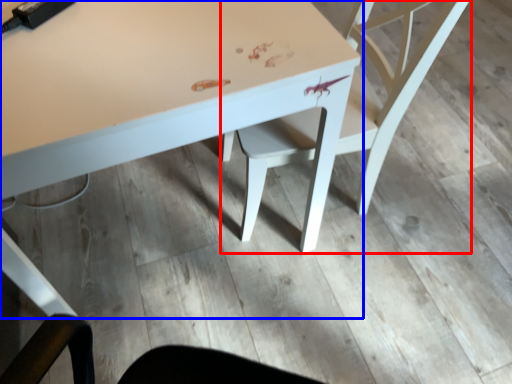
Question: Which object appears farthest to the camera in this image, chair (highlighted by a red box) or table (highlighted by a blue box)?

Choices:
 (A) chair
 (B) table

Answer: (A)